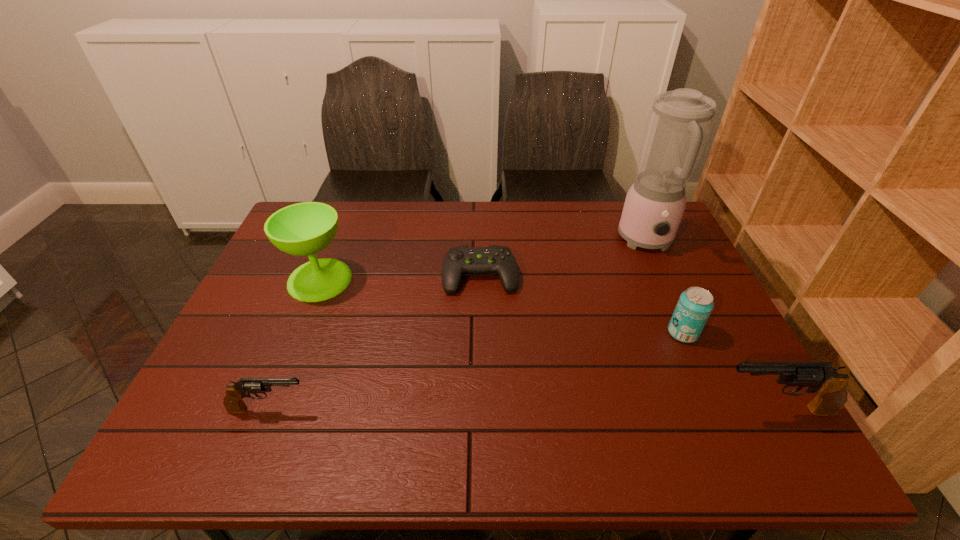
To ensure equal spacing by inserting another gun among them, please point out a vacant spot for this new gun. Please provide its 2D coordinates. Your answer should be formatted as a tuple, i.e. [(x, y)], where the tuple contains the x and y coordinates of a point satisfying the conditions above.

[(521, 409)]